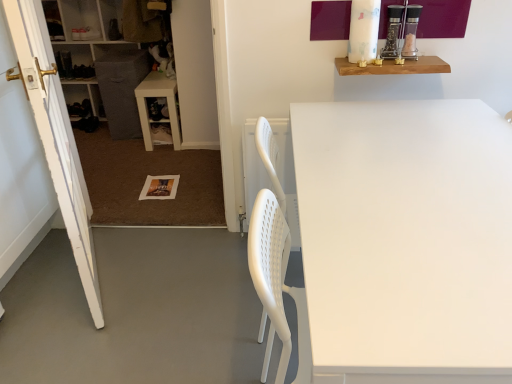
The height and width of the screenshot is (384, 512). Identify the location of white matte table at center, placed as the 2th table when sorted from left to right. (406, 240).

Find the location of a particular element. Image resolution: width=512 pixels, height=384 pixels. white painted wood door at left is located at coordinates (56, 137).

Image resolution: width=512 pixels, height=384 pixels. What are the coordinates of `white matte table at center, placed as the 2th table when sorted from left to right` in the screenshot? It's located at (406, 240).

From a real-world perspective, is white plastic table at lower left, the 1th table from the left, physically above white matte table at center, the 1th table positioned from the front?

No, from a real-world perspective, white plastic table at lower left, the 1th table from the left, is not over white matte table at center, the 1th table positioned from the front

Is white plastic table at lower left, arranged as the first table when viewed from the top, at the left side of white matte table at center, the first table from the right?

Correct, you'll find white plastic table at lower left, arranged as the first table when viewed from the top, to the left of white matte table at center, the first table from the right.

Is white plastic table at lower left, arranged as the first table when viewed from the top, further to camera compared to white matte table at center, placed as the second table when sorted from top to bottom?

Yes, white plastic table at lower left, arranged as the first table when viewed from the top, is behind white matte table at center, placed as the second table when sorted from top to bottom.

Considering the points (147, 150) and (426, 250), which point is in front, point (147, 150) or point (426, 250)?

The point (426, 250) is closer.

Which is correct: white plastic cabinet at left is inside wooden shelf at upper right, or outside of it?

white plastic cabinet at left lies outside wooden shelf at upper right.

From a real-world perspective, between white plastic cabinet at left and wooden shelf at upper right, who is vertically lower?

From a 3D spatial view, white plastic cabinet at left is below.

From the image's perspective, who appears lower, white plastic cabinet at left or wooden shelf at upper right?

wooden shelf at upper right, from the image's perspective.

Is white plastic table at lower left, the 2th table positioned from the bottom, positioned far away from white plastic cabinet at left?

white plastic table at lower left, the 2th table positioned from the bottom, is actually quite close to white plastic cabinet at left.

Is white plastic table at lower left, arranged as the first table when viewed from the top, not within white plastic cabinet at left?

Indeed, white plastic table at lower left, arranged as the first table when viewed from the top, is completely outside white plastic cabinet at left.

From a real-world perspective, which is physically below, white plastic table at lower left, the 2th table positioned from the bottom, or white plastic cabinet at left?

white plastic table at lower left, the 2th table positioned from the bottom.

Between white plastic table at lower left, arranged as the first table when viewed from the top, and white plastic cabinet at left, which one appears on the right side from the viewer's perspective?

white plastic table at lower left, arranged as the first table when viewed from the top.

Would you say white painted wood door at left is inside or outside white matte table at center, which appears as the first table when ordered from the bottom?

white painted wood door at left is not inside white matte table at center, which appears as the first table when ordered from the bottom, it's outside.

The image size is (512, 384). Find the location of `door that is behind the white matte table at center, placed as the second table when sorted from top to bottom`. door that is behind the white matte table at center, placed as the second table when sorted from top to bottom is located at coordinates point(56,137).

How far apart are white painted wood door at left and white matte table at center, which appears as the 2th table when viewed from the back?

white painted wood door at left is 1.05 meters from white matte table at center, which appears as the 2th table when viewed from the back.

Is point (72, 151) in front of point (487, 115)?

No, (72, 151) is behind (487, 115).

Looking at this image, considering the positions of objects wooden shelf at upper right and white plastic table at lower left, the 2th table positioned from the bottom, in the image provided, who is more to the left, wooden shelf at upper right or white plastic table at lower left, the 2th table positioned from the bottom,?

white plastic table at lower left, the 2th table positioned from the bottom, is more to the left.

Is wooden shelf at upper right positioned beyond the bounds of white plastic table at lower left, arranged as the first table when viewed from the top?

Yes, wooden shelf at upper right is not within white plastic table at lower left, arranged as the first table when viewed from the top.

Considering the positions of points (433, 64) and (173, 89), is point (433, 64) closer to camera compared to point (173, 89)?

Yes, it is.

Where is `shelf in front of the white plastic table at lower left, which is counted as the first table, starting from the back`? The image size is (512, 384). shelf in front of the white plastic table at lower left, which is counted as the first table, starting from the back is located at coordinates [394, 67].

Does wooden shelf at upper right have a greater height compared to white painted wood door at left?

Incorrect, the height of wooden shelf at upper right is not larger of that of white painted wood door at left.

Is wooden shelf at upper right positioned with its back to white painted wood door at left?

No, wooden shelf at upper right is not facing away from white painted wood door at left.

Can white painted wood door at left be found inside wooden shelf at upper right?

No, white painted wood door at left is not surrounded by wooden shelf at upper right.

Is there a large distance between wooden shelf at upper right and white painted wood door at left?

That's right, there is a large distance between wooden shelf at upper right and white painted wood door at left.

Does wooden shelf at upper right lie behind white matte table at center, which appears as the first table when ordered from the bottom?

Yes, it is.

Looking at the image, does wooden shelf at upper right seem bigger or smaller compared to white matte table at center, placed as the second table when sorted from top to bottom?

In the image, wooden shelf at upper right appears to be smaller than white matte table at center, placed as the second table when sorted from top to bottom.

Is wooden shelf at upper right positioned with its back to white matte table at center, which appears as the first table when ordered from the bottom?

No.

Find the location of a particular element. table below the white matte table at center, the first table from the right (from a real-world perspective) is located at coordinates (155, 98).

Identify the location of cabinetry located above the wooden shelf at upper right (from the image's perspective). The image size is (512, 384). (101, 62).

Looking at the image, which one is located further to white plastic table at lower left, arranged as the first table when viewed from the top, white matte table at center, which appears as the first table when ordered from the bottom, or white plastic cabinet at left?

The object further to white plastic table at lower left, arranged as the first table when viewed from the top, is white matte table at center, which appears as the first table when ordered from the bottom.

Which object lies nearer to the anchor point white painted wood door at left, white matte table at center, the first table from the right, or white plastic table at lower left, the 1th table from the left?

white matte table at center, the first table from the right.

Based on their spatial positions, is white plastic table at lower left, the 1th table from the left, or white matte table at center, which appears as the first table when ordered from the bottom, further from white painted wood door at left?

Based on the image, white plastic table at lower left, the 1th table from the left, appears to be further to white painted wood door at left.

Estimate the real-world distances between objects in this image. Which object is further from wooden shelf at upper right, white painted wood door at left or white plastic cabinet at left?

white plastic cabinet at left is positioned further to the anchor wooden shelf at upper right.

Based on their spatial positions, is white plastic cabinet at left or white plastic table at lower left, the 2th table positioned from the bottom, further from white painted wood door at left?

The object further to white painted wood door at left is white plastic cabinet at left.

From the image, which object appears to be farther from white plastic cabinet at left, white plastic table at lower left, which is counted as the first table, starting from the back, or wooden shelf at upper right?

wooden shelf at upper right lies further to white plastic cabinet at left than the other object.

Which object lies nearer to the anchor point white plastic cabinet at left, white matte table at center, which appears as the 2th table when viewed from the back, or white plastic table at lower left, the 2th table positioned from the bottom?

Based on the image, white plastic table at lower left, the 2th table positioned from the bottom, appears to be nearer to white plastic cabinet at left.

Estimate the real-world distances between objects in this image. Which object is further from white plastic table at lower left, the second table when ordered from front to back, white plastic cabinet at left or white painted wood door at left?

white painted wood door at left is positioned further to the anchor white plastic table at lower left, the second table when ordered from front to back.

You are a GUI agent. You are given a task and a screenshot of the screen. Output one action in this format:
    pyautogui.click(x=<x>, y=<y>)
    Task: Click on the shelf between white matte table at center, the 1th table positioned from the front, and white plastic cabinet at left, along the z-axis
    
    Given the screenshot: What is the action you would take?
    pyautogui.click(x=394, y=67)

In order to click on door located between white matte table at center, the first table from the right, and white plastic cabinet at left in the depth direction in this screenshot , I will do `click(56, 137)`.

Find the location of a particular element. This screenshot has height=384, width=512. shelf between white painted wood door at left and white plastic cabinet at left in the front-back direction is located at coordinates (394, 67).

Locate an element on the screen. This screenshot has width=512, height=384. shelf between white matte table at center, the first table from the right, and white plastic table at lower left, the 1th table from the left, along the z-axis is located at coordinates (394, 67).